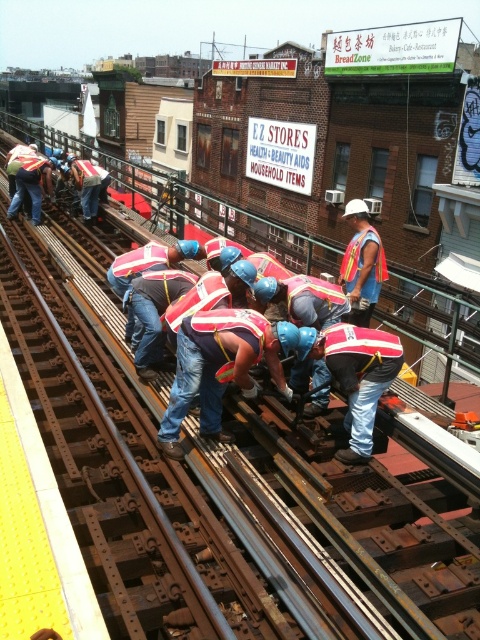
Who is shorter, red reflective vest at center or reflective orange vest at center?

Standing shorter between the two is reflective orange vest at center.

Between red reflective vest at center and reflective orange vest at center, which one has more height?

Result: red reflective vest at center is taller.

Is point (259, 349) positioned in front of point (357, 285)?

That is True.

At what (x,y) coordinates should I click in order to perform the action: click on red reflective vest at center. Please return your answer as a coordinate pair (x, y). This screenshot has height=640, width=480. Looking at the image, I should click on (220, 368).

Can you confirm if reflective silver helmet at center is thinner than reflective orange vest at center?

In fact, reflective silver helmet at center might be wider than reflective orange vest at center.

This screenshot has width=480, height=640. In order to click on reflective silver helmet at center in this screenshot , I will do `click(356, 376)`.

Between point (394, 342) and point (370, 228), which one is positioned behind?

Positioned behind is point (370, 228).

Locate an element on the screen. reflective silver helmet at center is located at coordinates (356, 376).

Who is shorter, red reflective vest at center or reflective silver helmet at center?

With less height is reflective silver helmet at center.

The image size is (480, 640). What are the coordinates of `red reflective vest at center` in the screenshot? It's located at (220, 368).